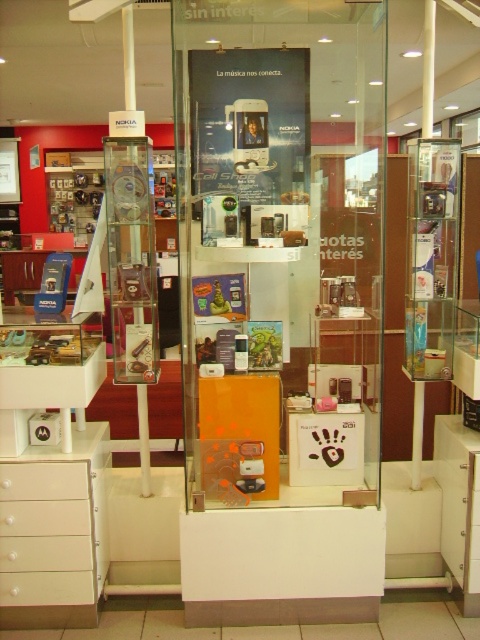
Question: Which point is farther to the camera?

Choices:
 (A) transparent glass display case at center
 (B) white matte drawer at lower left
 (C) white plastic drawer at lower left

Answer: (B)

Question: Which point appears closest to the camera in this image?

Choices:
 (A) (46, 465)
 (B) (269, 397)

Answer: (A)

Question: Can you confirm if white plastic drawer at lower left is bigger than white matte drawer at lower left?

Choices:
 (A) no
 (B) yes

Answer: (B)

Question: Does white plastic drawer at lower left have a smaller size compared to white matte drawer at lower left?

Choices:
 (A) yes
 (B) no

Answer: (B)

Question: Does transparent glass display case at center have a smaller size compared to white plastic drawer at lower left?

Choices:
 (A) no
 (B) yes

Answer: (A)

Question: Among these objects, which one is farthest from the camera?

Choices:
 (A) transparent glass display case at center
 (B) white matte drawer at lower left

Answer: (B)